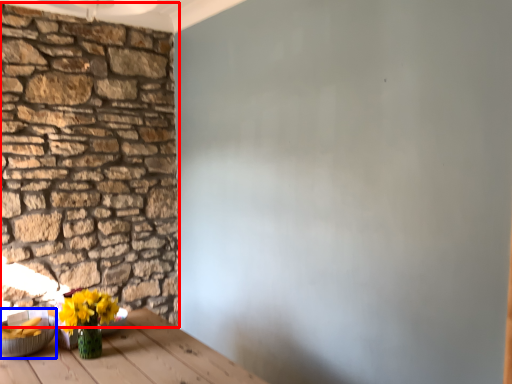
Question: Which of the following is the farthest to the observer, brick (highlighted by a red box) or bowl (highlighted by a blue box)?

Choices:
 (A) brick
 (B) bowl

Answer: (A)